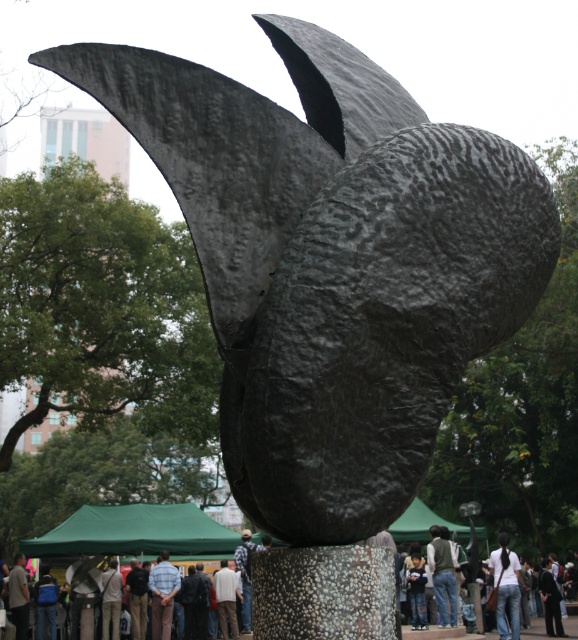
Question: Among these points, which one is nearest to the camera?

Choices:
 (A) (242, 572)
 (B) (164, 616)
 (C) (444, 580)
 (D) (499, 576)

Answer: (B)

Question: Which point is farther from the camera taking this photo?

Choices:
 (A) (258, 570)
 (B) (234, 592)

Answer: (B)

Question: Can you confirm if jeans at center is smaller than light blue shirt at center?

Choices:
 (A) no
 (B) yes

Answer: (B)

Question: From the image, what is the correct spatial relationship of jeans at center in relation to light brown leather jacket at center?

Choices:
 (A) above
 (B) below

Answer: (A)

Question: Among these points, which one is farthest from the camera?

Choices:
 (A) (150, 586)
 (B) (223, 621)

Answer: (B)

Question: Can you confirm if light brown leather jacket at center is positioned to the left of plaid shirt at center?

Choices:
 (A) no
 (B) yes

Answer: (B)